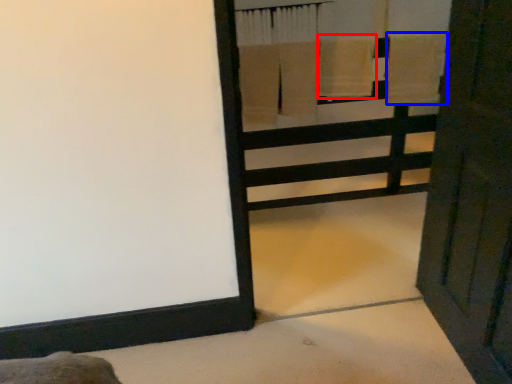
Question: Among these objects, which one is farthest to the camera, bath towel (highlighted by a red box) or bath towel (highlighted by a blue box)?

Choices:
 (A) bath towel
 (B) bath towel

Answer: (B)